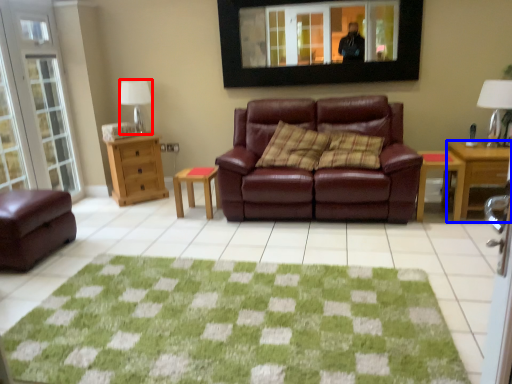
Question: Among these objects, which one is nearest to the camera, lamp (highlighted by a red box) or desk (highlighted by a blue box)?

Choices:
 (A) lamp
 (B) desk

Answer: (B)